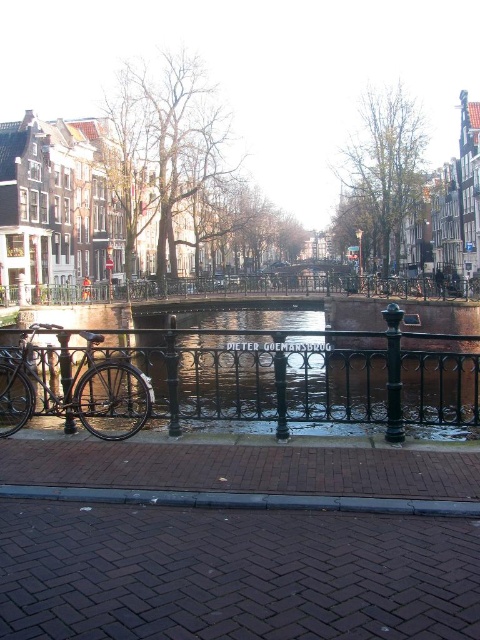
The width and height of the screenshot is (480, 640). In order to click on dark brick pavement at lower center in this screenshot , I will do `click(233, 573)`.

Between dark brick pavement at lower center and black wrought iron fence at center, which one appears on the right side from the viewer's perspective?

Positioned to the right is dark brick pavement at lower center.

Describe the element at coordinates (233, 573) in the screenshot. The height and width of the screenshot is (640, 480). I see `dark brick pavement at lower center` at that location.

Where is `dark brick pavement at lower center`? dark brick pavement at lower center is located at coordinates (233, 573).

Does point (242, 502) come behind point (121, 429)?

That is False.

Between point (345, 490) and point (8, 401), which one is positioned in front?

Point (345, 490)

I want to click on brick pavement at lower center, so pos(242,474).

Who is positioned more to the right, shiny black bicycle at left or black wrought iron fence at center?

Result: black wrought iron fence at center is more to the right.

Can you confirm if shiny black bicycle at left is bigger than black wrought iron fence at center?

Actually, shiny black bicycle at left might be smaller than black wrought iron fence at center.

Which is in front, point (36, 381) or point (37, 288)?

Point (36, 381) is more forward.

The height and width of the screenshot is (640, 480). Find the location of `shiny black bicycle at left`. shiny black bicycle at left is located at coordinates (75, 390).